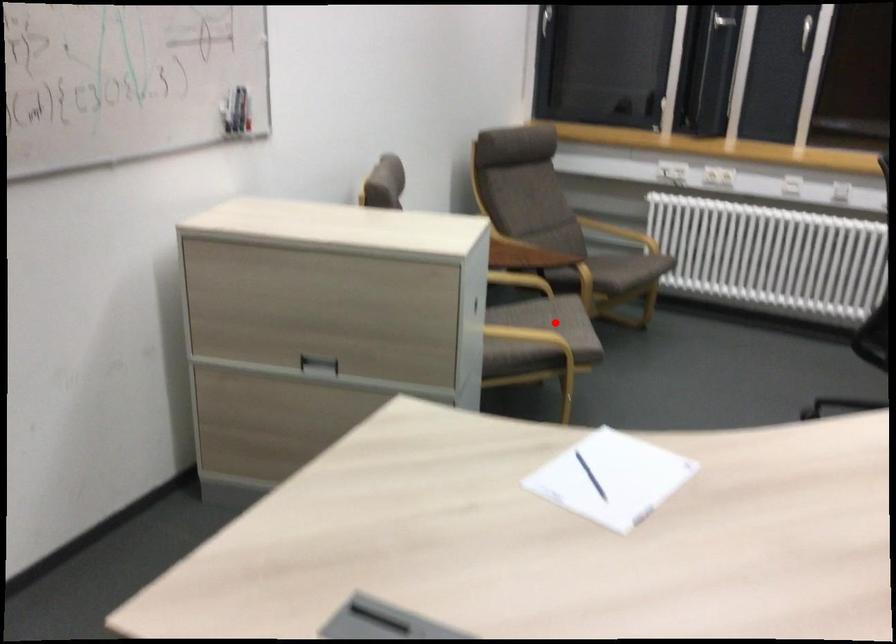
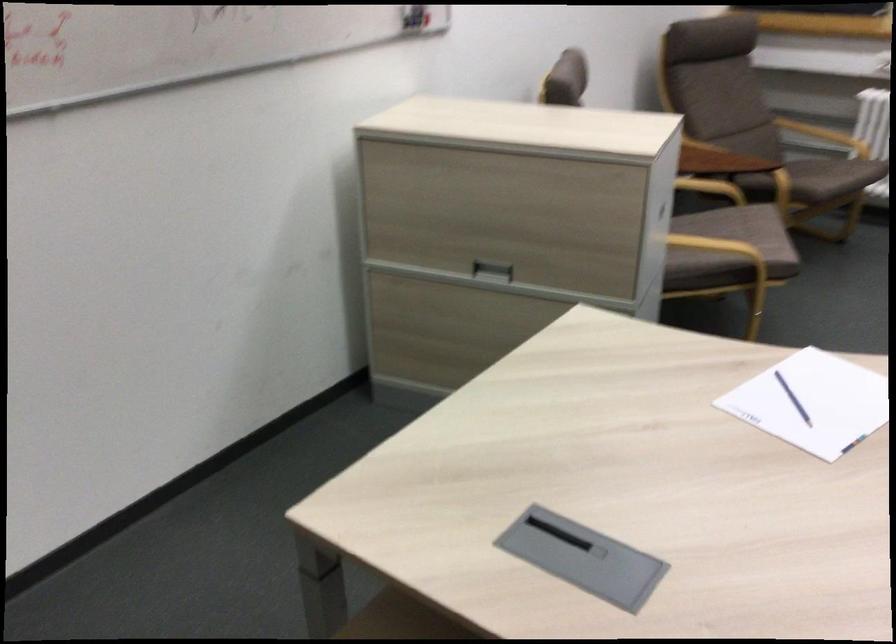
Question: I am providing you with two images of the same scene from different viewpoints. In image1, a red point is highlighted. Considering the same 3D point in image2, which of the following is correct?

Choices:
 (A) It is closer
 (B) It is farther

Answer: (A)